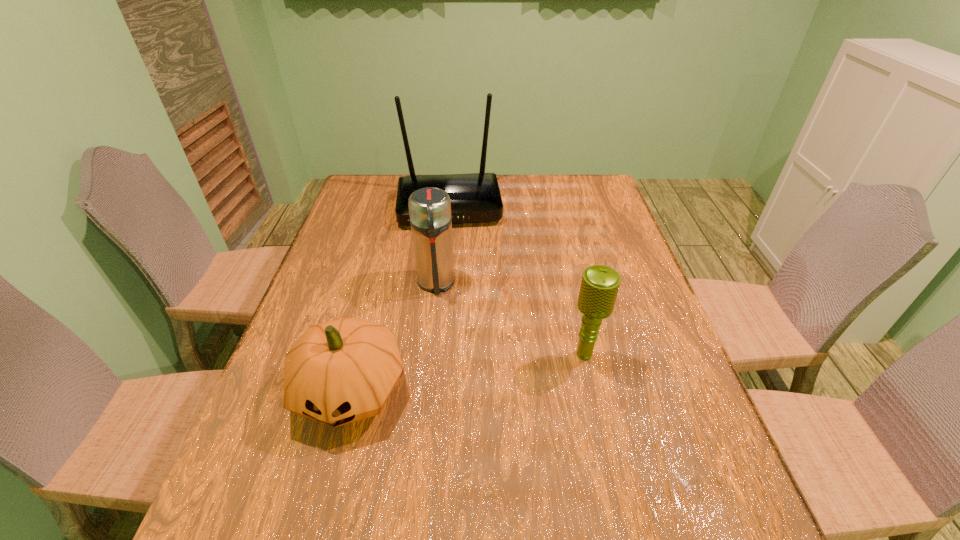
Find the location of `gourd`. gourd is located at coordinates (341, 371).

At what (x,y) coordinates should I click in order to perform the action: click on microphone. Please return your answer as a coordinate pair (x, y). The image size is (960, 540). Looking at the image, I should click on (599, 287).

Locate an element on the screen. This screenshot has width=960, height=540. the tallest object is located at coordinates (475, 197).

Identify the location of router. Image resolution: width=960 pixels, height=540 pixels. (475, 197).

Where is `thermos bottle`? The image size is (960, 540). thermos bottle is located at coordinates (429, 208).

Find the location of a particular element. Image resolution: width=960 pixels, height=540 pixels. vacant space located on the back of the microphone is located at coordinates (567, 279).

Locate an element on the screen. The width and height of the screenshot is (960, 540). free space located 0.400m on the front-facing side of the farthest object is located at coordinates (457, 321).

Identify the location of free space located 0.120m on the front-facing side of the farthest object. (453, 254).

This screenshot has height=540, width=960. I want to click on free space located on the front-facing side of the farthest object, so click(455, 282).

Identify the location of vacant region located 0.120m with a handle on the side of the second farthest object. The image size is (960, 540). (438, 334).